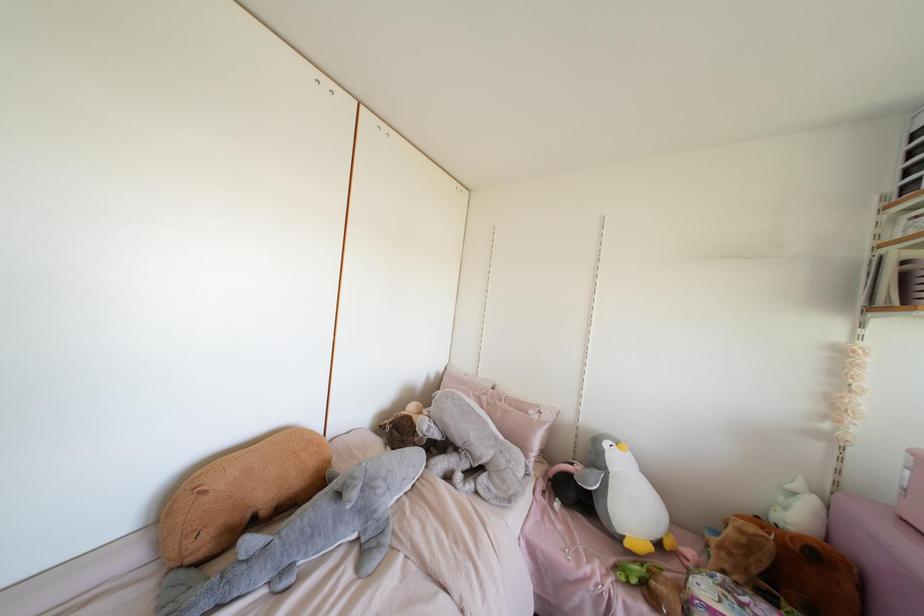
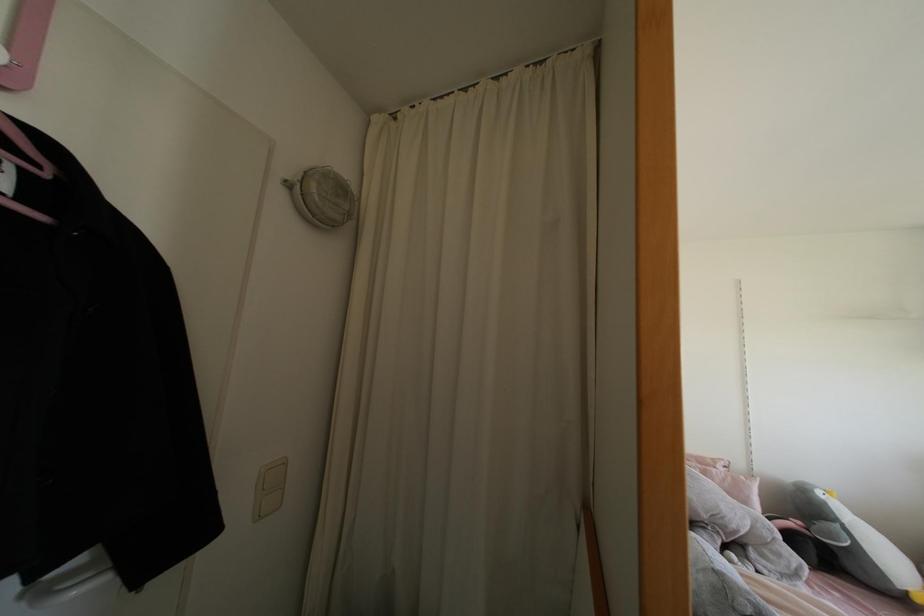
Locate, in the second image, the point that corresponds to point 604,444 in the first image.

(819, 493)